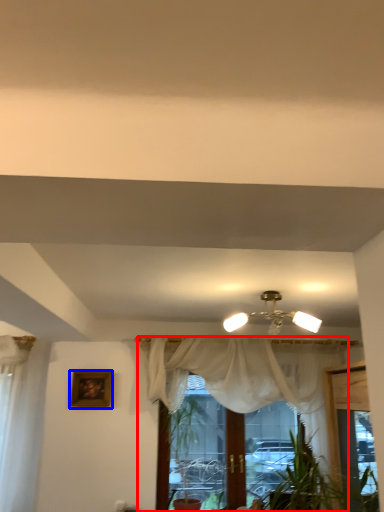
Question: Among these objects, which one is nearest to the camera, curtain (highlighted by a red box) or picture frame (highlighted by a blue box)?

Choices:
 (A) curtain
 (B) picture frame

Answer: (A)